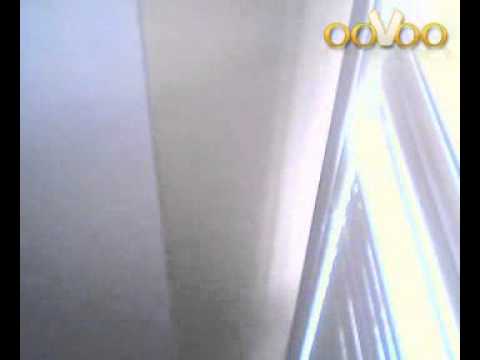
In order to click on wall in this screenshot , I will do `click(289, 202)`.